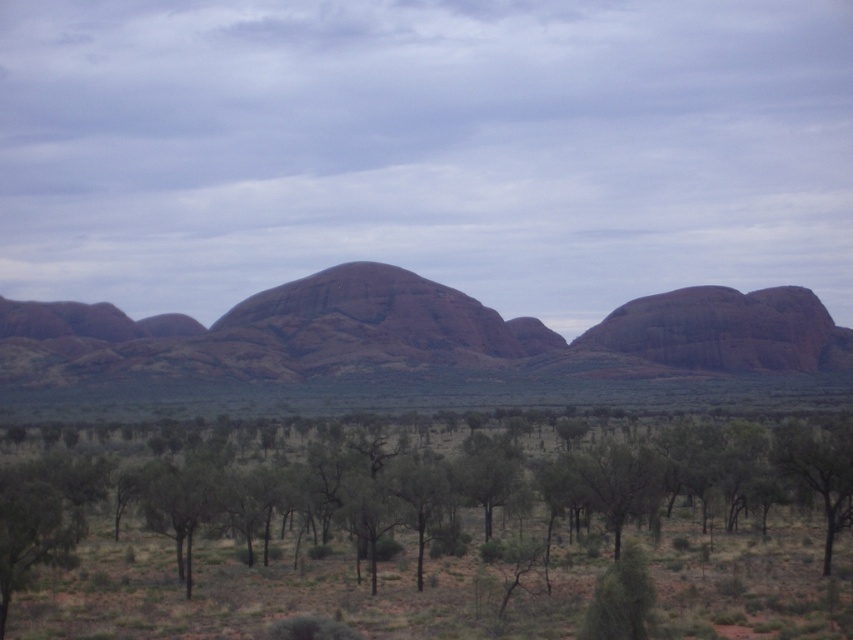
You are standing at the center of the image and want to locate the rustic rock formation at center. According to the coordinates provided, in which direction should you look to find it?

The rustic rock formation at center is located at coordinates point [416,337], which is very close to the center of the image. Therefore, you should look straight ahead to find it.

You are an explorer in the desert and see the rustic rock formation at center and the green leafy tree at lower right. Which object is closer to you?

The green leafy tree at lower right is closer to you because the rustic rock formation at center is positioned over it, indicating it is further away.